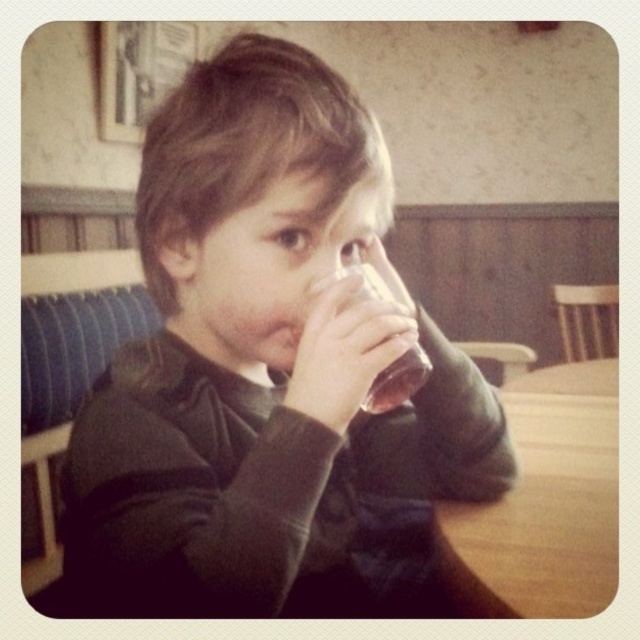
Is point (616, 568) in front of point (388, 289)?

No.

How far apart are wooden table at lower right and translucent glass at mouth?

wooden table at lower right is 21.63 inches away from translucent glass at mouth.

Between point (541, 547) and point (394, 385), which one is positioned in front?

Point (394, 385)

At what (x,y) coordinates should I click in order to perform the action: click on wooden table at lower right. Please return your answer as a coordinate pair (x, y). Looking at the image, I should click on (545, 502).

Between matte glass at center and translucent glass at mouth, which one has less height?

translucent glass at mouth

Which is in front, point (321, 180) or point (365, 276)?

Point (321, 180) is more forward.

Who is more forward, (145, 506) or (349, 268)?

Point (145, 506) is in front.

You are a GUI agent. You are given a task and a screenshot of the screen. Output one action in this format:
    pyautogui.click(x=<x>, y=<y>)
    Task: Click on the matte glass at center
    This screenshot has height=640, width=640.
    Given the screenshot: What is the action you would take?
    pyautogui.click(x=269, y=372)

Can you confirm if matte glass at center is smaller than wooden table at lower right?

No, matte glass at center is not smaller than wooden table at lower right.

Which is more to the right, matte glass at center or wooden table at lower right?

wooden table at lower right

Locate an element on the screen. The image size is (640, 640). matte glass at center is located at coordinates (269, 372).

Identify the location of matte glass at center. (269, 372).